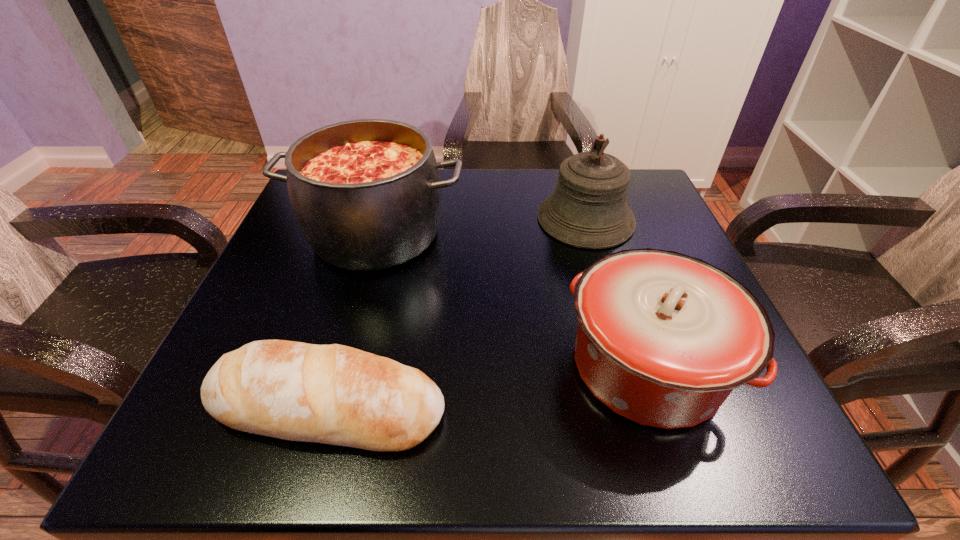
Image resolution: width=960 pixels, height=540 pixels. In order to click on object that is at the far right corner in this screenshot , I will do `click(588, 209)`.

Where is `object at the near right corner`? object at the near right corner is located at coordinates (663, 338).

I want to click on vacant space at the far edge of the desktop, so click(525, 210).

In the image, there is a desktop. Identify the location of vacant space at the near edge. (561, 456).

The image size is (960, 540). Find the location of `vacant space at the left edge of the desktop`. vacant space at the left edge of the desktop is located at coordinates (270, 265).

Find the location of a particular element. The height and width of the screenshot is (540, 960). free point at the near right corner is located at coordinates (717, 417).

What are the coordinates of `free point between the farther casserole and the bell` in the screenshot? It's located at (481, 226).

Locate an element on the screen. The image size is (960, 540). free space between the farther casserole and the shorter casserole is located at coordinates (512, 300).

The height and width of the screenshot is (540, 960). I want to click on unoccupied area between the bread and the taller casserole, so click(352, 320).

This screenshot has height=540, width=960. I want to click on blank region between the bread and the right casserole, so point(488,386).